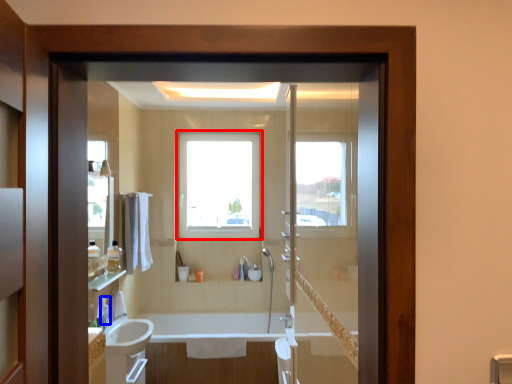
Question: Which point is closer to the camera, window (highlighted by a red box) or toiletry (highlighted by a blue box)?

Choices:
 (A) window
 (B) toiletry

Answer: (B)